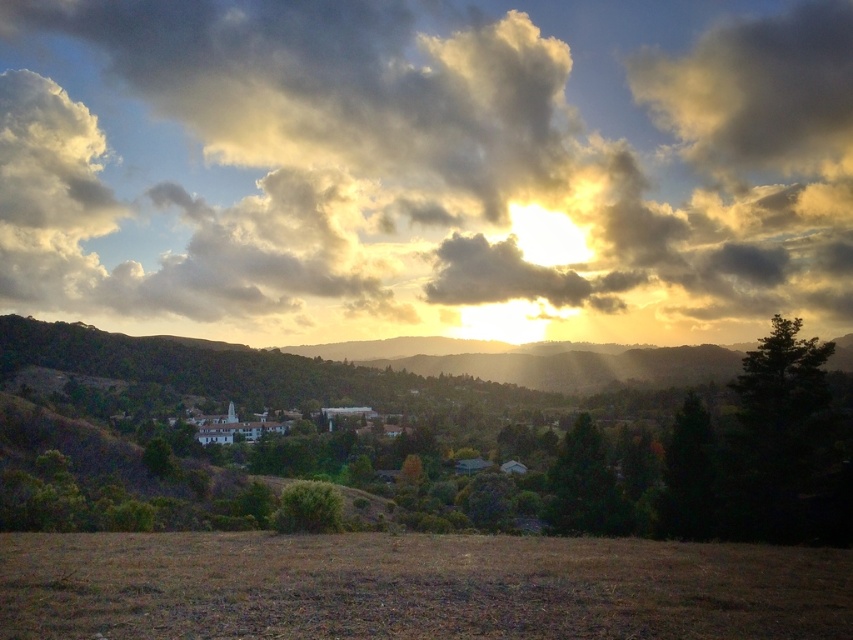
You are standing in the landscape scene and want to climb a tree to get a better view of the buildings in the midground. Which tree would you choose between the green leafy tree at center and the dark green leafy tree at right?

You should choose the green leafy tree at center because it has a greater height compared to the dark green leafy tree at right, providing a better vantage point for viewing the buildings in the midground.

You are standing at the edge of the scene and want to walk towards the green matte tree at right. Is the path clear of the brown grass at lower center?

The brown grass at lower center might be wider than green matte tree at right, so there could be brown grass in the path towards the green matte tree at right. The path might not be completely clear.